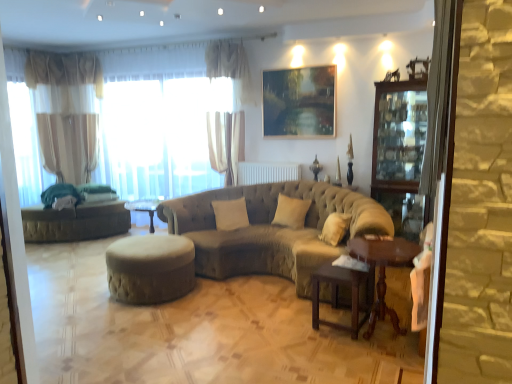
Question: Is sheer fabric curtain at left, positioned as the first curtain in left-to-right order, oriented towards translucent fabric at left?

Choices:
 (A) no
 (B) yes

Answer: (B)

Question: Is sheer fabric curtain at left, positioned as the first curtain in left-to-right order, thinner than translucent fabric at left?

Choices:
 (A) no
 (B) yes

Answer: (B)

Question: Is sheer fabric curtain at left, which is the second curtain in front-to-back order, positioned with its back to translucent fabric at left?

Choices:
 (A) no
 (B) yes

Answer: (A)

Question: Does sheer fabric curtain at left, arranged as the second curtain when viewed from the right, come in front of translucent fabric at left?

Choices:
 (A) no
 (B) yes

Answer: (A)

Question: Is sheer fabric curtain at left, which is the second curtain in front-to-back order, beside translucent fabric at left?

Choices:
 (A) yes
 (B) no

Answer: (B)

Question: Relative to stone textured screen door at right, is transparent glass cabinet at right in front or behind?

Choices:
 (A) behind
 (B) front

Answer: (A)

Question: Considering the relative positions of transparent glass cabinet at right and stone textured screen door at right in the image provided, is transparent glass cabinet at right to the left or to the right of stone textured screen door at right?

Choices:
 (A) right
 (B) left

Answer: (A)

Question: Is transparent glass cabinet at right spatially inside stone textured screen door at right, or outside of it?

Choices:
 (A) outside
 (B) inside

Answer: (A)

Question: Is point (425, 216) positioned closer to the camera than point (445, 34)?

Choices:
 (A) farther
 (B) closer

Answer: (A)

Question: In terms of width, does translucent fabric at left look wider or thinner when compared to metallic painting at upper center?

Choices:
 (A) wide
 (B) thin

Answer: (A)

Question: Is point pos(110,84) closer or farther from the camera than point pos(300,127)?

Choices:
 (A) closer
 (B) farther

Answer: (B)

Question: Relative to metallic painting at upper center, is translucent fabric at left in front or behind?

Choices:
 (A) behind
 (B) front

Answer: (A)

Question: From a real-world perspective, relative to metallic painting at upper center, is translucent fabric at left vertically above or below?

Choices:
 (A) below
 (B) above

Answer: (A)

Question: From a real-world perspective, is translucent fabric at left positioned above or below brown wooden table at lower right, the 1th table positioned from the left?

Choices:
 (A) above
 (B) below

Answer: (A)

Question: Considering their positions, is translucent fabric at left located in front of or behind brown wooden table at lower right, the 1th table positioned from the left?

Choices:
 (A) front
 (B) behind

Answer: (B)